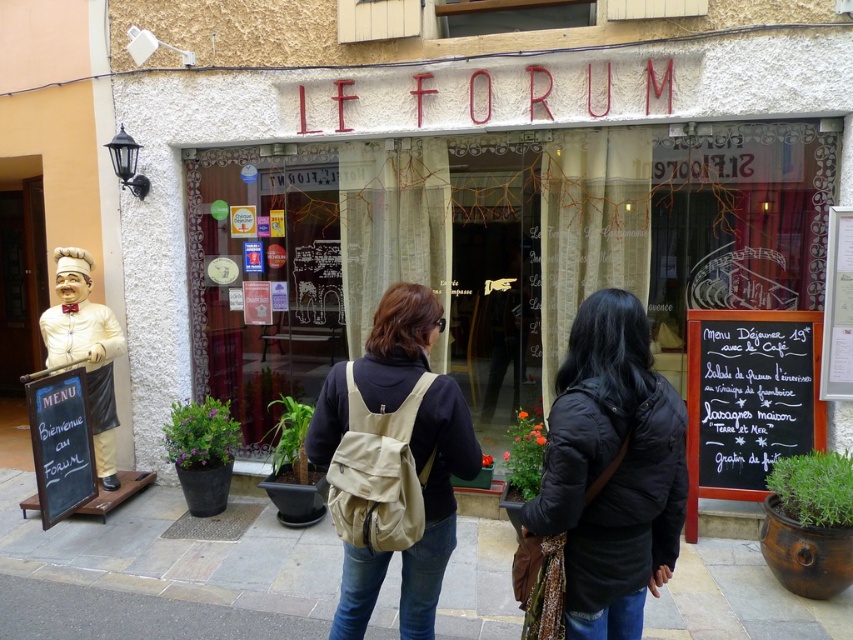
Does beige fabric backpack at center have a greater height compared to white porcelain statue at left?

No, beige fabric backpack at center is not taller than white porcelain statue at left.

Between point (328, 467) and point (103, 403), which one is positioned in front?

Positioned in front is point (328, 467).

Is point (418, 355) positioned before point (115, 412)?

Yes.

The height and width of the screenshot is (640, 853). Identify the location of beige fabric backpack at center. (393, 461).

Does translucent glass shop window at center have a greater width compared to black matte jacket at center?

Correct, the width of translucent glass shop window at center exceeds that of black matte jacket at center.

I want to click on translucent glass shop window at center, so click(x=492, y=250).

I want to click on translucent glass shop window at center, so click(x=492, y=250).

From the picture: Can you confirm if black matte jacket at center is positioned to the right of black chalkboard menu at lower left?

Indeed, black matte jacket at center is positioned on the right side of black chalkboard menu at lower left.

Consider the image. Does black matte jacket at center lie in front of black chalkboard menu at lower left?

That is True.

The image size is (853, 640). What do you see at coordinates (602, 483) in the screenshot?
I see `black matte jacket at center` at bounding box center [602, 483].

Where is `black matte jacket at center`? black matte jacket at center is located at coordinates (602, 483).